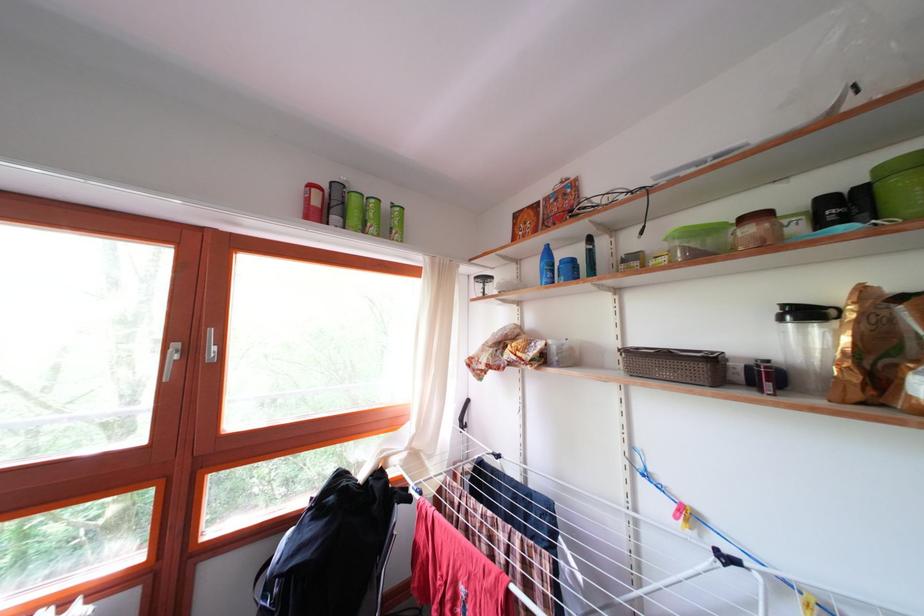
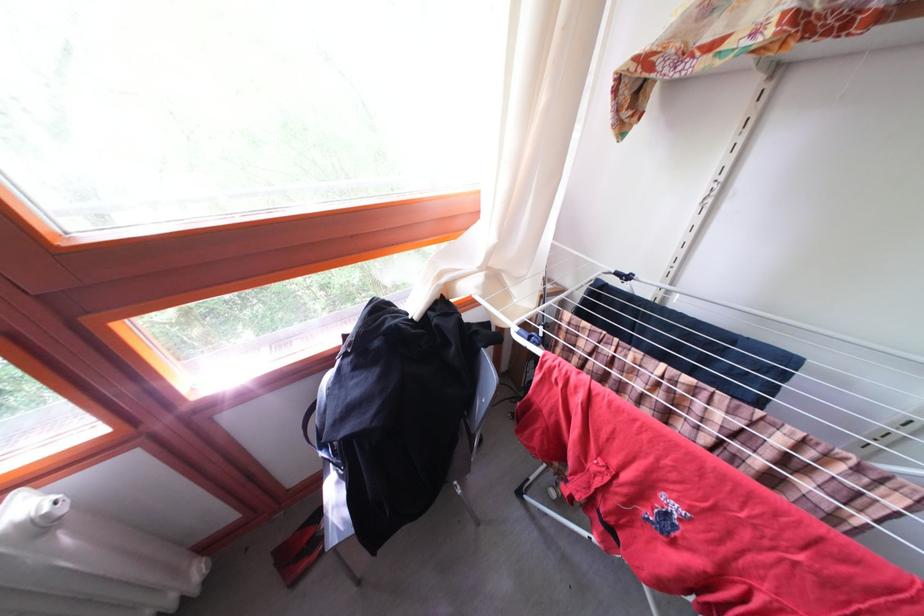
Question: How did the camera likely rotate?

Choices:
 (A) Left
 (B) Right
 (C) Up
 (D) Down

Answer: (D)